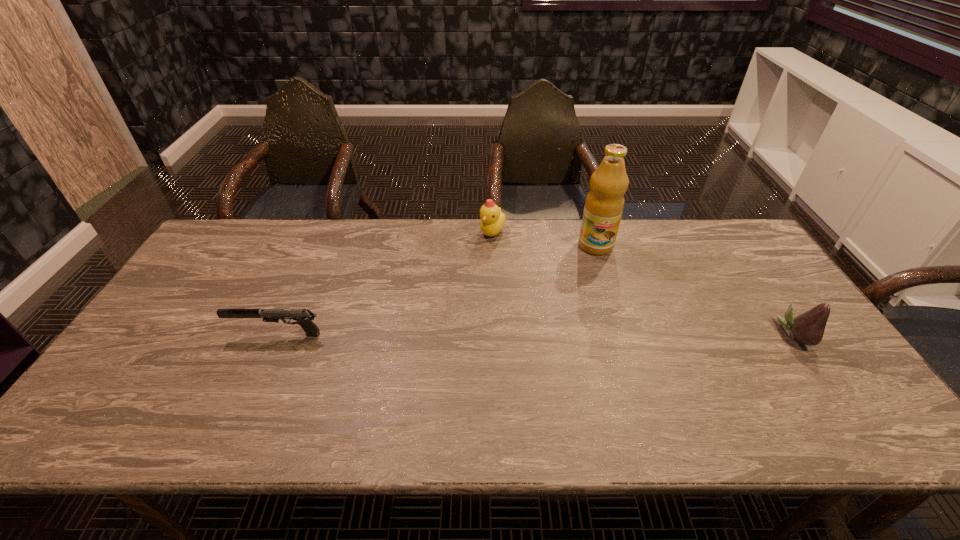
At what (x,y) coordinates should I click in order to perform the action: click on free space between the rightmost object and the second object from left to right. Please return your answer as a coordinate pair (x, y). Looking at the image, I should click on (643, 284).

Find the location of `unoccupied position between the leftmost object and the third object from right to left`. unoccupied position between the leftmost object and the third object from right to left is located at coordinates (385, 284).

Locate an element on the screen. unoccupied area between the rightmost object and the second object from left to right is located at coordinates click(x=643, y=284).

In order to click on free space between the leftmost object and the avocado in this screenshot , I will do `click(536, 334)`.

This screenshot has width=960, height=540. What are the coordinates of `vacant space in between the third object from left to right and the second object from left to right` in the screenshot? It's located at (544, 239).

Find the location of a particular element. object that can be found as the second closest to the rightmost object is located at coordinates click(x=492, y=219).

Locate which object is the second closest to the tallest object. Please provide its 2D coordinates. Your answer should be formatted as a tuple, i.e. [(x, y)], where the tuple contains the x and y coordinates of a point satisfying the conditions above.

[(808, 328)]

Image resolution: width=960 pixels, height=540 pixels. I want to click on free region that satisfies the following two spatial constraints: 1. on the front side of the second object from right to left; 2. on the left side of the duckling, so click(492, 246).

Where is `free space in the image that satisfies the following two spatial constraints: 1. on the front side of the third object from right to left; 2. on the seed side of the rightmost object`? Image resolution: width=960 pixels, height=540 pixels. free space in the image that satisfies the following two spatial constraints: 1. on the front side of the third object from right to left; 2. on the seed side of the rightmost object is located at coordinates (496, 334).